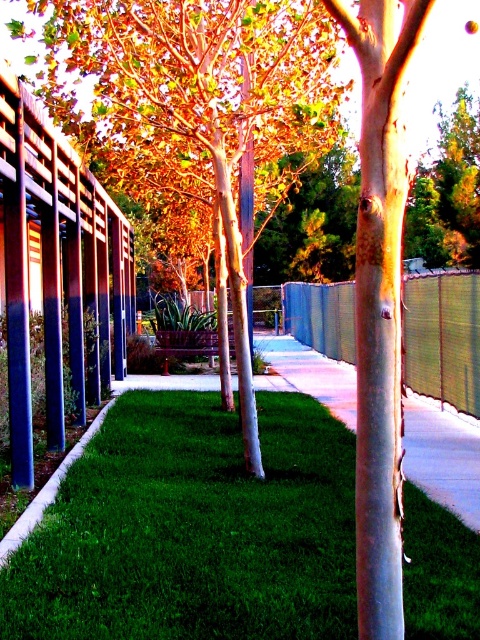
You are planning to install a new garden feature between the green grass at center and the metallic woven fence at center. Which of these two objects has a larger area to work with?

The metallic woven fence at center has a larger area than the green grass at center, so you should consider working with that space.

You are standing at the entrance of the pathway and want to walk towards the trees on the right. Which object, the green grass at center or the metallic woven fence at center, will you encounter first?

The green grass at center is to the left of the metallic woven fence at center, so you will encounter the green grass at center first as you walk towards the trees on the right.

You are standing at the origin point of the image. If you walk straight ahead, will you step onto the green grass at center before reaching the blue pergola posts on the left?

The green grass at center is located at coordinate point (193, 529), which is further away from the origin than the blue pergola posts on the left. Therefore, you would reach the blue pergola posts on the left before stepping onto the green grass at center.